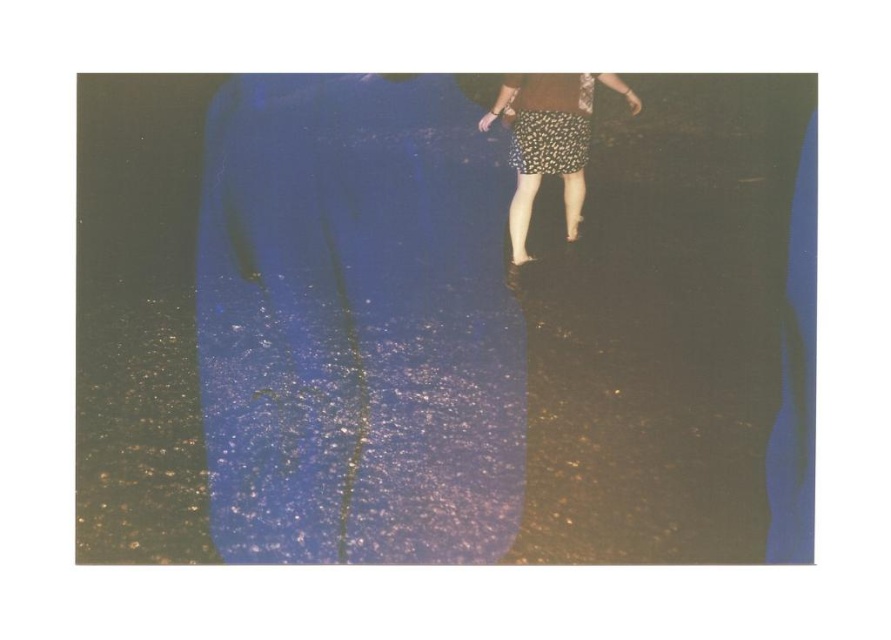
Which is in front, point (573, 106) or point (590, 93)?

Point (573, 106)

Does floral skirt at center come in front of floral fabric dress at center?

No, floral skirt at center is further to the viewer.

Between point (583, 164) and point (548, 102), which one is positioned behind?

Point (583, 164)

What are the coordinates of `floral skirt at center` in the screenshot? It's located at (549, 140).